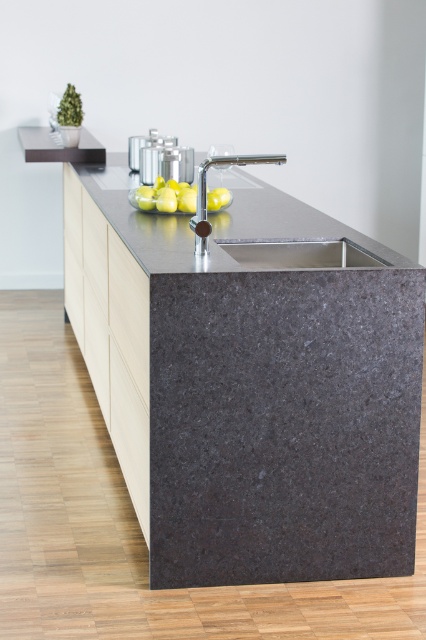
You are a kitchen designer planning to install a new faucet. The faucet you chose is 10 cm taller than the white glossy sink at center. Will the faucet exceed the height of the yellow matte lemon at center?

The white glossy sink at center is shorter than the yellow matte lemon at center. Since the faucet is 10 cm taller than the sink, it will be taller than the lemon.

You are a chef preparing ingredients and need to rinse them under the faucet. You have a lemon from the yellow matte lemon at center. Where should you place the lemon to rinse it under the water from the white glossy sink at center?

The white glossy sink at center is positioned under the yellow matte lemon at center, so you should move the lemon from the yellow matte lemon at center down to the sink area to rinse it under the faucet.